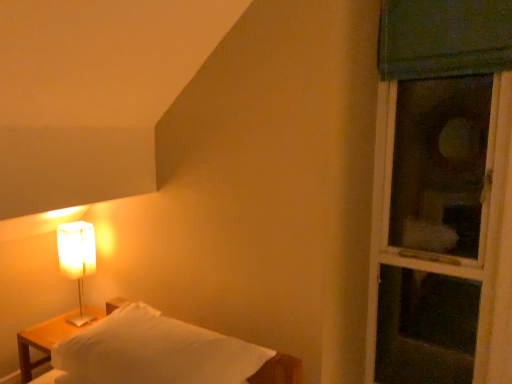
Question: Can we say green fabric window at right lies outside white matte rectangular lamp at left?

Choices:
 (A) no
 (B) yes

Answer: (B)

Question: Does green fabric window at right appear on the right side of white matte rectangular lamp at left?

Choices:
 (A) yes
 (B) no

Answer: (A)

Question: Is green fabric window at right further to camera compared to white matte rectangular lamp at left?

Choices:
 (A) yes
 (B) no

Answer: (B)

Question: Is white matte rectangular lamp at left at the back of green fabric window at right?

Choices:
 (A) yes
 (B) no

Answer: (B)

Question: From the image's perspective, is green fabric window at right on white matte rectangular lamp at left?

Choices:
 (A) yes
 (B) no

Answer: (A)

Question: From a real-world perspective, is white matte rectangular lamp at left above or below green fabric window at right?

Choices:
 (A) below
 (B) above

Answer: (A)

Question: Is point (84, 231) positioned closer to the camera than point (482, 307)?

Choices:
 (A) farther
 (B) closer

Answer: (A)

Question: In terms of width, does white matte rectangular lamp at left look wider or thinner when compared to green fabric window at right?

Choices:
 (A) wide
 (B) thin

Answer: (B)

Question: Which is correct: white matte rectangular lamp at left is inside green fabric window at right, or outside of it?

Choices:
 (A) outside
 (B) inside

Answer: (A)

Question: Considering their positions, is wooden nightstand at left located in front of or behind green fabric window at right?

Choices:
 (A) front
 (B) behind

Answer: (B)

Question: Is wooden nightstand at left wider or thinner than green fabric window at right?

Choices:
 (A) thin
 (B) wide

Answer: (B)

Question: From a real-world perspective, is wooden nightstand at left physically located above or below green fabric window at right?

Choices:
 (A) below
 (B) above

Answer: (A)

Question: Based on their sizes in the image, would you say wooden nightstand at left is bigger or smaller than green fabric window at right?

Choices:
 (A) small
 (B) big

Answer: (A)

Question: Does point (126, 375) appear closer or farther from the camera than point (439, 268)?

Choices:
 (A) closer
 (B) farther

Answer: (A)

Question: In terms of height, does white matte bed at lower left look taller or shorter compared to green fabric window at right?

Choices:
 (A) tall
 (B) short

Answer: (B)